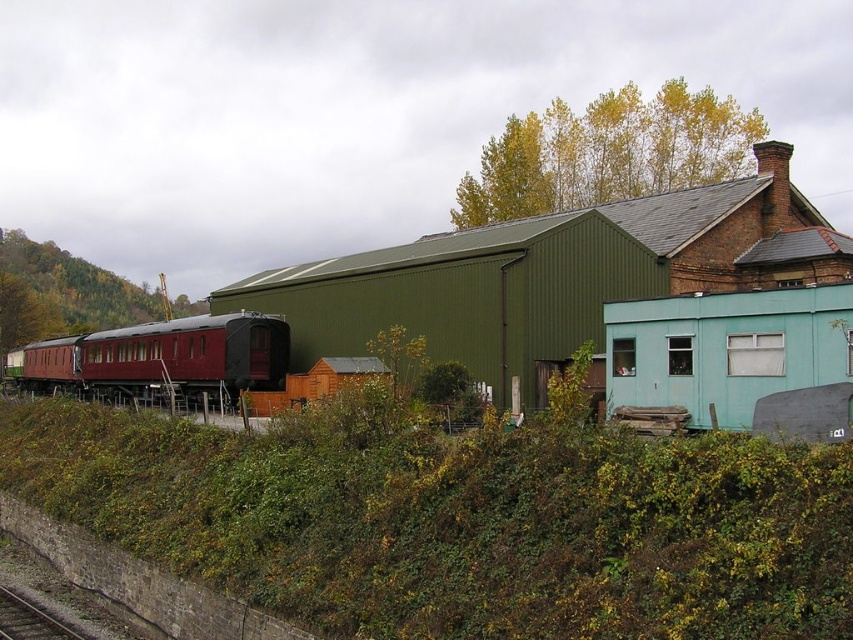
Question: Among these objects, which one is farthest from the camera?

Choices:
 (A) green leafy vegetation at lower center
 (B) green corrugated metal shed at center

Answer: (B)

Question: Which of the following is the closest to the observer?

Choices:
 (A) (209, 378)
 (B) (705, 252)

Answer: (B)

Question: Is green corrugated metal shed at center below maroon polished wood train car at left?

Choices:
 (A) no
 (B) yes

Answer: (A)

Question: Which object appears farthest from the camera in this image?

Choices:
 (A) smooth metal train track at lower left
 (B) green leafy vegetation at lower center
 (C) maroon polished wood train car at left
 (D) green corrugated metal shed at center

Answer: (C)

Question: Is the position of maroon polished wood train car at left less distant than that of smooth metal train track at lower left?

Choices:
 (A) yes
 (B) no

Answer: (B)

Question: Can you confirm if maroon polished wood train car at left is bigger than smooth metal train track at lower left?

Choices:
 (A) yes
 (B) no

Answer: (A)